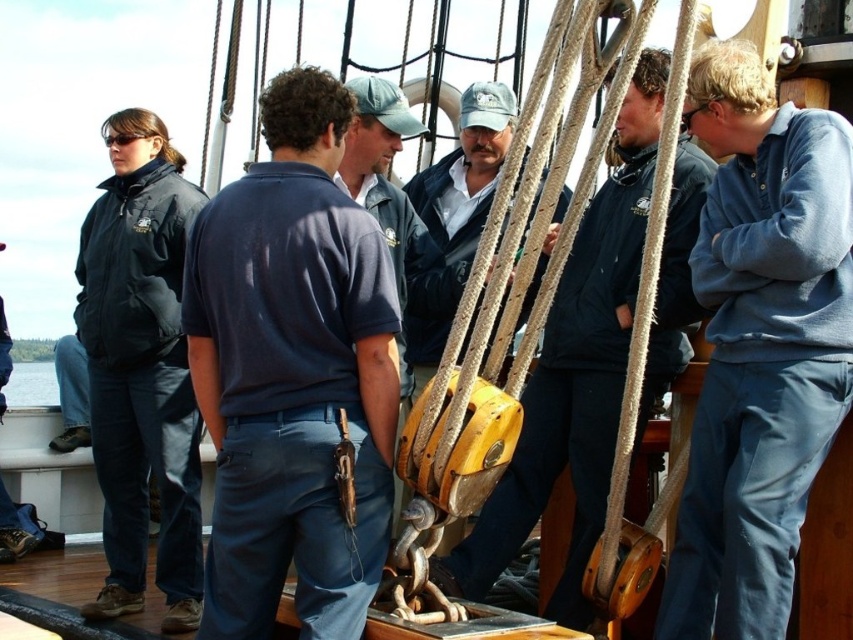
Who is taller, dark blue cotton polo shirt at center or dark blue jacket at center?

Standing taller between the two is dark blue jacket at center.

Can you confirm if dark blue cotton polo shirt at center is positioned above dark blue jacket at center?

No.

Who is more forward, (370, 534) or (608, 282)?

Point (370, 534) is in front.

At what (x,y) coordinates should I click in order to perform the action: click on dark blue cotton polo shirt at center. Please return your answer as a coordinate pair (x, y). Image resolution: width=853 pixels, height=640 pixels. Looking at the image, I should click on (293, 372).

Is dark blue jacket at center above black matte jacket at left?

Correct, dark blue jacket at center is located above black matte jacket at left.

Does dark blue jacket at center lie in front of black matte jacket at left?

Yes, dark blue jacket at center is closer to the viewer.

This screenshot has width=853, height=640. Describe the element at coordinates (575, 372) in the screenshot. I see `dark blue jacket at center` at that location.

Identify the location of dark blue jacket at center. pyautogui.click(x=575, y=372).

Is light blue fleece at right closer to camera compared to black matte jacket at left?

Yes.

Can you confirm if light blue fleece at right is smaller than black matte jacket at left?

Indeed, light blue fleece at right has a smaller size compared to black matte jacket at left.

Locate an element on the screen. light blue fleece at right is located at coordinates (759, 346).